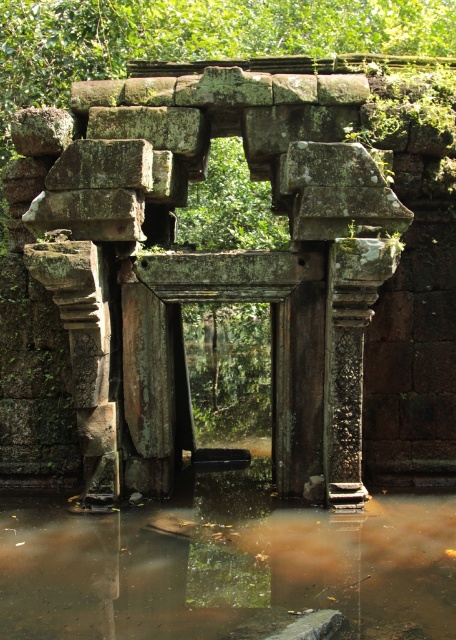
You are a tourist standing at the entrance of the ancient stone structure. You notice the green mossy stone arch at center and the brown murky water at center. Which object is positioned to the left of the other?

The green mossy stone arch at center is to the left of brown murky water at center.

You are a tour guide leading a group through this ancient site. You want to point out the green mossy stone arch at center and the brown murky water at center. Which one is taller?

The green mossy stone arch at center is much taller than the brown murky water at center.

Based on the photo, you are a tourist visiting the ancient stone structure. You notice the green mossy stone arch at center and the brown murky water at center. Which object is positioned higher in elevation?

The green mossy stone arch at center is located above the brown murky water at center, so it is positioned higher in elevation.